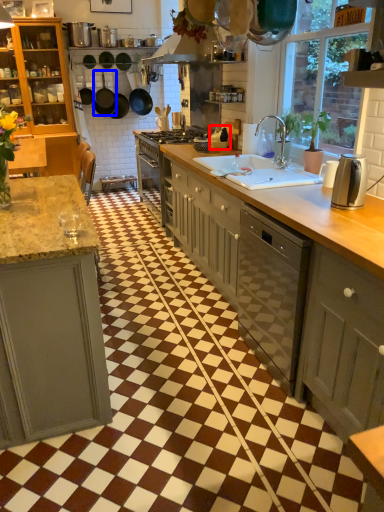
Question: Which point is further to the camera, appliance (highlighted by a red box) or frying pan (highlighted by a blue box)?

Choices:
 (A) appliance
 (B) frying pan

Answer: (B)